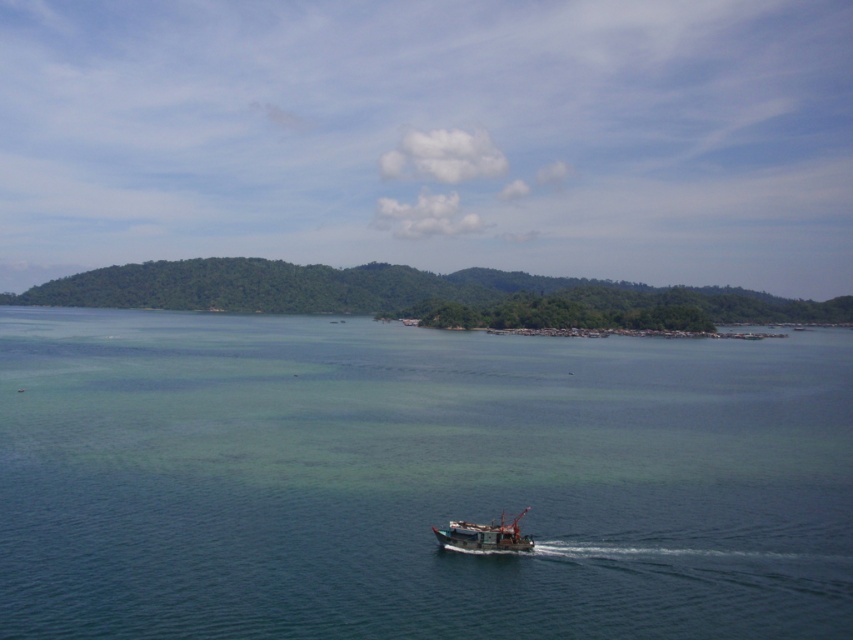
Question: Which point appears farthest from the camera in this image?

Choices:
 (A) [517, 531]
 (B) [286, 611]

Answer: (A)

Question: Does clear blue water at center come behind wooden fishing boat at center?

Choices:
 (A) yes
 (B) no

Answer: (B)

Question: Which point is closer to the camera?

Choices:
 (A) wooden fishing boat at center
 (B) clear blue water at center

Answer: (B)

Question: Does clear blue water at center have a lesser width compared to wooden fishing boat at center?

Choices:
 (A) yes
 (B) no

Answer: (B)

Question: Does clear blue water at center come in front of wooden fishing boat at center?

Choices:
 (A) no
 (B) yes

Answer: (B)